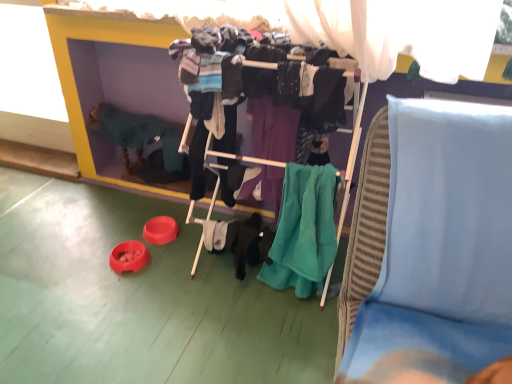
You are a GUI agent. You are given a task and a screenshot of the screen. Output one action in this format:
    pyautogui.click(x=<x>, y=<y>)
    Task: Click on the free space below teal soft towel at center (from a real-world perspective)
    
    Given the screenshot: What is the action you would take?
    pyautogui.click(x=288, y=313)